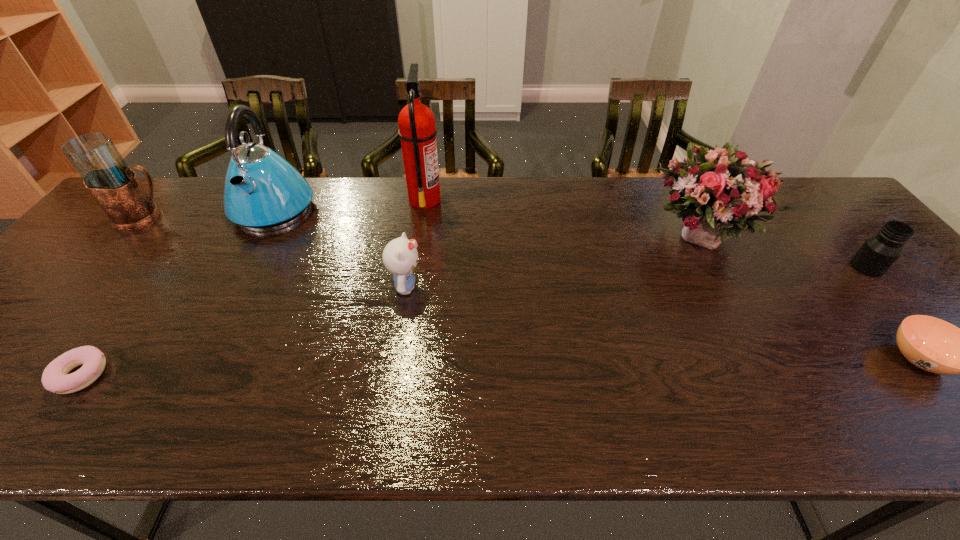
Image resolution: width=960 pixels, height=540 pixels. Find the location of `vacant space that satisfies the following two spatial constraints: 1. with the handle on the side of the pitcher; 2. on the right side of the shortest object`. vacant space that satisfies the following two spatial constraints: 1. with the handle on the side of the pitcher; 2. on the right side of the shortest object is located at coordinates (12, 375).

The height and width of the screenshot is (540, 960). I want to click on free space that satisfies the following two spatial constraints: 1. on the side of the fire extinguisher near the handle; 2. on the front side of the doughnut, so click(x=399, y=375).

Identify the location of free space that satisfies the following two spatial constraints: 1. on the side of the tallest object near the handle; 2. on the back side of the jar. This screenshot has width=960, height=540. (415, 267).